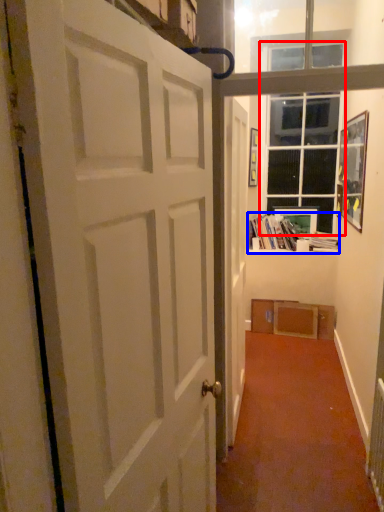
Question: Among these objects, which one is nearest to the camera, window (highlighted by a red box) or book (highlighted by a blue box)?

Choices:
 (A) window
 (B) book

Answer: (A)